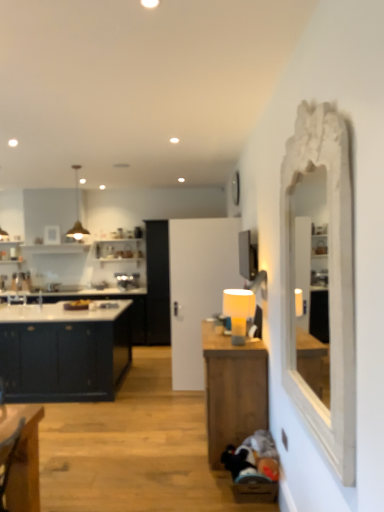
You are a GUI agent. You are given a task and a screenshot of the screen. Output one action in this format:
    pyautogui.click(x=<x>, y=<y>)
    Task: Click on the free point below matte yellow lampshade at center-right (from a real-world perspective)
    
    Given the screenshot: What is the action you would take?
    pyautogui.click(x=233, y=344)